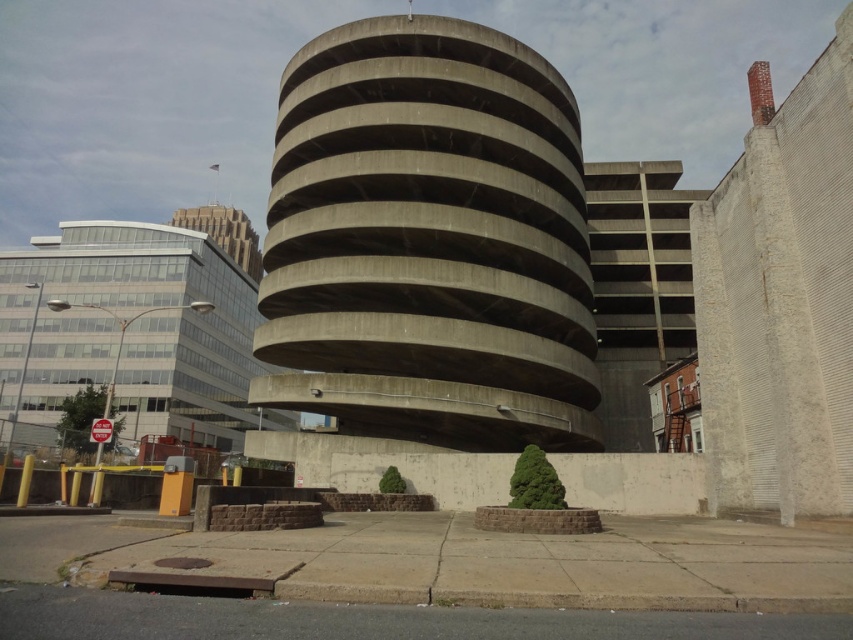
You are a delivery driver who needs to back your truck into the parking garage. Your truck requires a minimum of 100 feet of clearance between the concrete at center and the concrete building at left to safely maneuver. Based on the scene, can you safely back into the garage?

The concrete at center is 126.96 feet away from the concrete building at left, which exceeds the required 100 feet clearance. Therefore, you can safely back into the garage.

You are standing at the center of the image and want to locate the concrete building at left. According to the coordinates provided, in which direction should you look to find it?

The concrete building at left is located at coordinates 0.519 in the x axis and 0.158 in the y axis. Since the x coordinate is greater than 0.5, you should look to the right side of the image to find the concrete building at left.